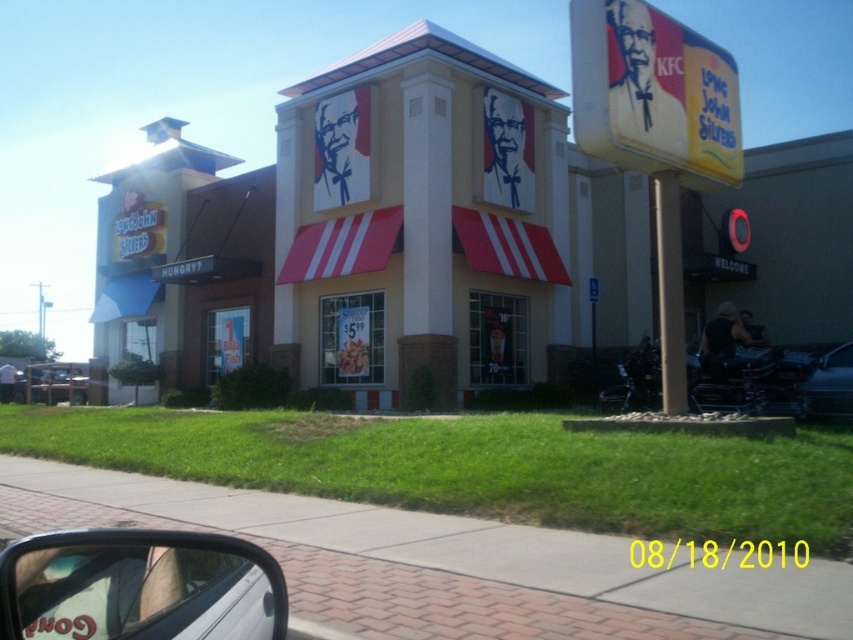
You are a delivery driver who needs to pick up an order from the KFC restaurant. You see a yellow paper date at center and a metallic silver truck at lower left. Which object is closer to the entrance of the restaurant?

The metallic silver truck at lower left is closer to the entrance of the restaurant because it is positioned to the left of the yellow paper date at center, which is further to the right.

Consider the image. You are a delivery driver who needs to park your vehicle in the KFC parking lot. You see a black matte car at right and a metallic silver truck at lower left. Which vehicle takes up less space in the parking spot?

The black matte car at right has a smaller size compared to the metallic silver truck at lower left, so it takes up less space in the parking spot.

You are standing at the entrance of the KFC restaurant and see two points marked on the ground. The first point is at coordinate point [848,374] and the second point is at coordinate point [38,388]. Which point is closer to you as you face the restaurant entrance?

Point [848,374] is in front of point [38,388], so the first point is closer to you as you face the restaurant entrance.